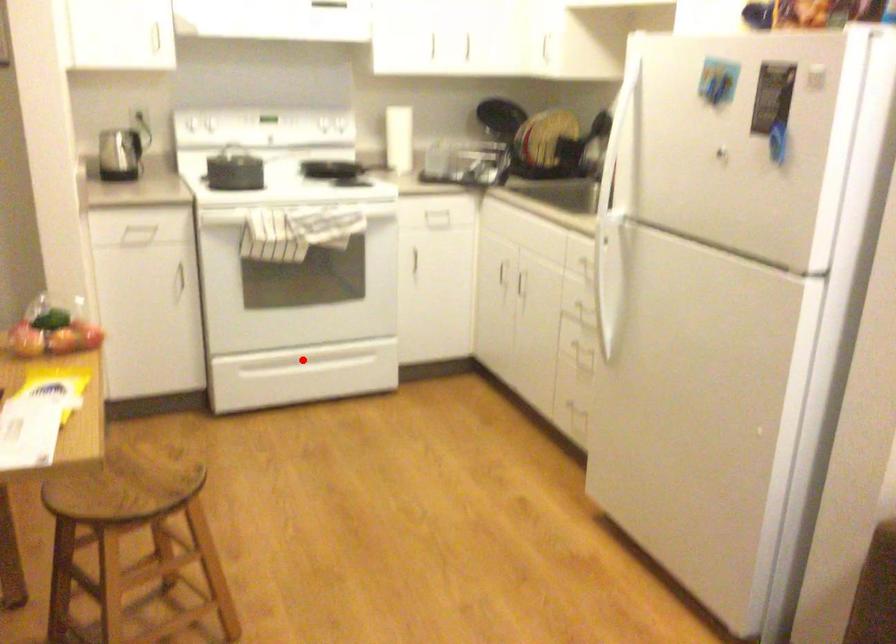
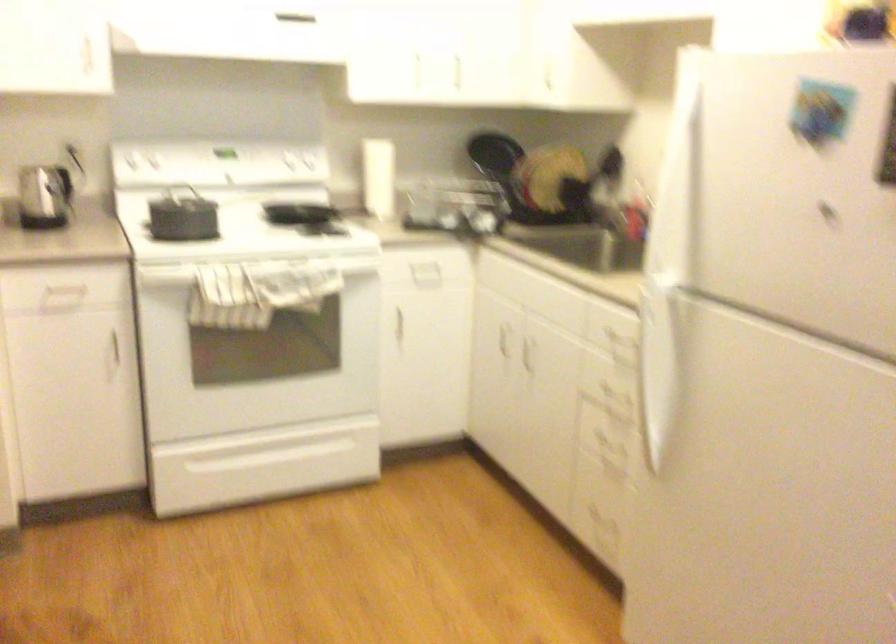
In the second image, find the point that corresponds to the highlighted location in the first image.

(263, 446)